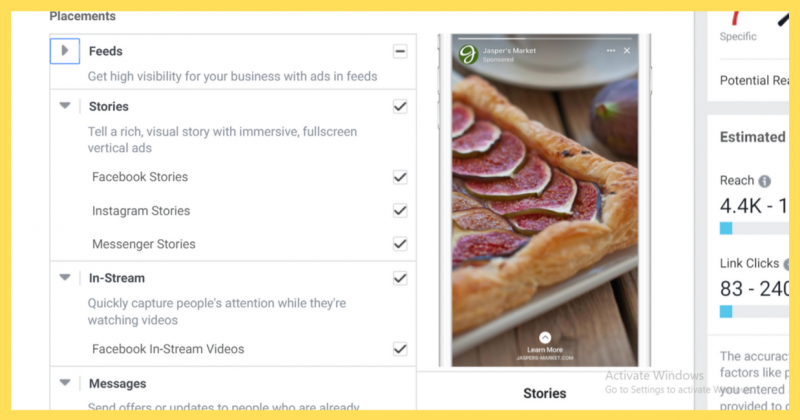
Identify the location of teacup. pyautogui.click(x=558, y=72).